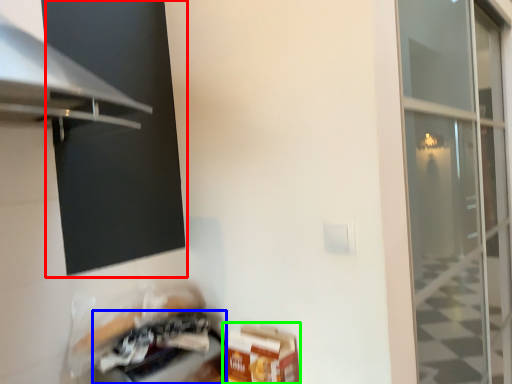
Question: Considering the real-world distances, which object is closest to window screen (highlighted by a red box)? appliance (highlighted by a blue box) or cardboard box (highlighted by a green box).

Choices:
 (A) appliance
 (B) cardboard box

Answer: (A)